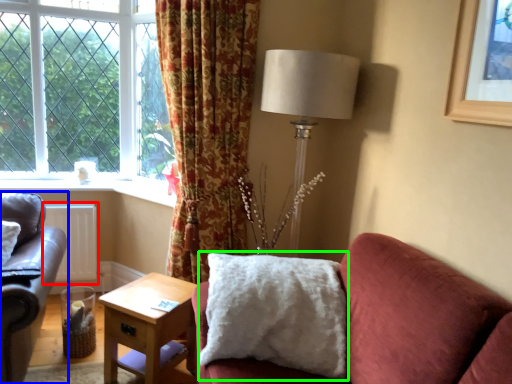
Question: Considering the real-world distances, which object is farthest from radiator (highlighted by a red box)? studio couch (highlighted by a blue box) or pillow (highlighted by a green box)?

Choices:
 (A) studio couch
 (B) pillow

Answer: (B)